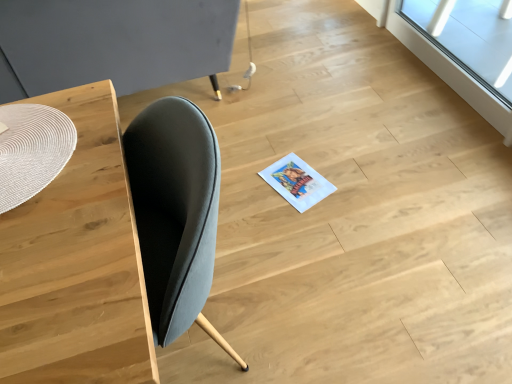
Question: From a real-world perspective, is white woven placemat at left, the second round table in the top-to-bottom sequence, on transparent glass window at upper right?

Choices:
 (A) no
 (B) yes

Answer: (B)

Question: Does white woven placemat at left, which appears as the 1th round table when ordered from the bottom, have a greater width compared to transparent glass window at upper right?

Choices:
 (A) yes
 (B) no

Answer: (A)

Question: Is white woven placemat at left, which appears as the 1th round table when ordered from the bottom, positioned beyond the bounds of transparent glass window at upper right?

Choices:
 (A) yes
 (B) no

Answer: (A)

Question: Is white woven placemat at left, the second round table in the back-to-front sequence, positioned in front of transparent glass window at upper right?

Choices:
 (A) yes
 (B) no

Answer: (A)

Question: Are white woven placemat at left, which is the 1th round table in front-to-back order, and transparent glass window at upper right far apart?

Choices:
 (A) yes
 (B) no

Answer: (A)

Question: From the image's perspective, is white woven placemat at left, the second round table in the top-to-bottom sequence, above transparent glass window at upper right?

Choices:
 (A) no
 (B) yes

Answer: (A)

Question: Can you confirm if white woven placemat at left, the second round table in the back-to-front sequence, is taller than wooden table at left?

Choices:
 (A) no
 (B) yes

Answer: (A)

Question: From the image's perspective, is white woven placemat at left, the second round table in the top-to-bottom sequence, located beneath wooden table at left?

Choices:
 (A) no
 (B) yes

Answer: (A)

Question: Is white woven placemat at left, the second round table in the back-to-front sequence, smaller than wooden table at left?

Choices:
 (A) no
 (B) yes

Answer: (B)

Question: Considering the relative sizes of white woven placemat at left, the second round table in the top-to-bottom sequence, and wooden table at left in the image provided, is white woven placemat at left, the second round table in the top-to-bottom sequence, bigger than wooden table at left?

Choices:
 (A) yes
 (B) no

Answer: (B)

Question: Does white woven placemat at left, which appears as the 1th round table when ordered from the bottom, touch wooden table at left?

Choices:
 (A) yes
 (B) no

Answer: (B)

Question: From a real-world perspective, is white woven placemat at left, the second round table in the top-to-bottom sequence, under wooden table at left?

Choices:
 (A) yes
 (B) no

Answer: (B)

Question: From the image's perspective, does wooden table at left appear lower than matte woven placemat at left, arranged as the 2th round table when viewed from the front?

Choices:
 (A) yes
 (B) no

Answer: (A)